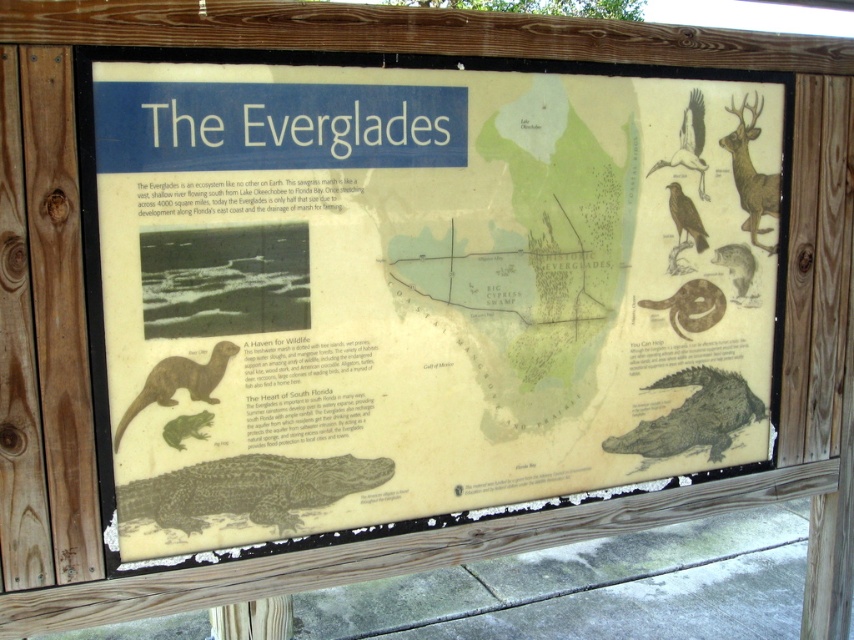
Can you confirm if brown velvet deer at upper right is thinner than brown matte snake at center-right?

Correct, brown velvet deer at upper right's width is less than brown matte snake at center-right's.

Who is lower down, brown velvet deer at upper right or brown matte snake at center-right?

brown matte snake at center-right is lower down.

Is point (759, 184) farther from viewer compared to point (697, 296)?

Yes, it is behind point (697, 296).

In order to click on brown velvet deer at upper right in this screenshot , I will do `click(752, 172)`.

Measure the distance between point (215, 490) and camera.

Point (215, 490) and camera are 1.99 meters apart.

Does dark green scaly alligator at center have a smaller size compared to brown matte snake at center-right?

Actually, dark green scaly alligator at center might be larger than brown matte snake at center-right.

Between point (264, 486) and point (700, 292), which one is positioned in front?

Point (264, 486) is more forward.

Identify the location of dark green scaly alligator at center. (247, 490).

Between beige paper map at center and green scaly crocodile at lower right, which one appears on the right side from the viewer's perspective?

Positioned to the right is green scaly crocodile at lower right.

Which is behind, point (651, 236) or point (691, 406)?

The point (691, 406) is more distant.

Find the location of `beige paper map at center`. beige paper map at center is located at coordinates (405, 288).